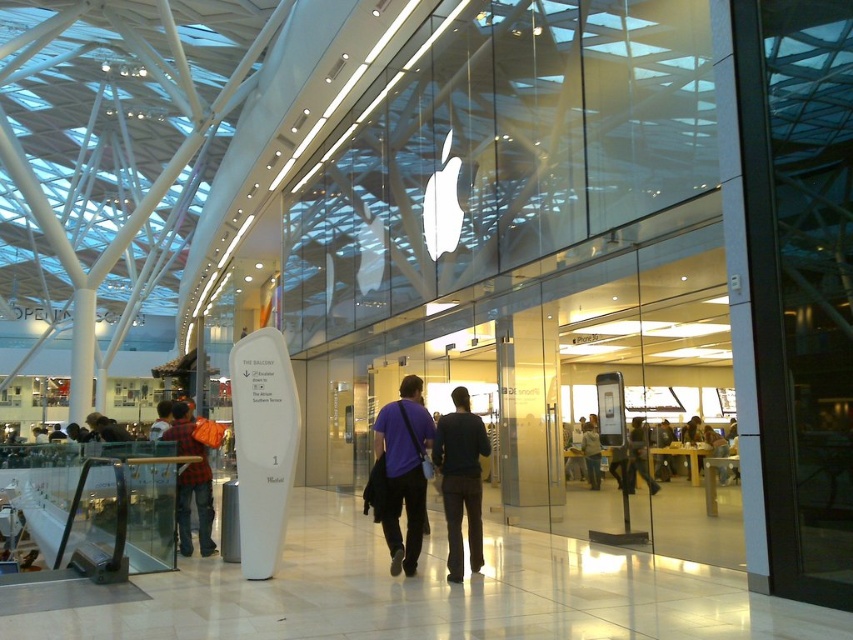
Question: Estimate the real-world distances between objects in this image. Which object is farther from the plaid shirt at left?

Choices:
 (A) black matte pants at center
 (B) matte black phone at center

Answer: (B)

Question: Is black matte pants at center thinner than light brown leather jacket at center?

Choices:
 (A) yes
 (B) no

Answer: (A)

Question: Which of these objects is positioned farthest from the purple fabric shirt at center?

Choices:
 (A) plaid shirt at left
 (B) black matte pants at center

Answer: (A)

Question: Based on their relative distances, which object is nearer to the plaid shirt at left?

Choices:
 (A) purple fabric shirt at center
 (B) light brown leather jacket at center

Answer: (A)

Question: Can you confirm if plaid shirt at left is bigger than matte black phone at center?

Choices:
 (A) no
 (B) yes

Answer: (A)

Question: Can you confirm if purple fabric shirt at center is thinner than light brown leather jacket at center?

Choices:
 (A) no
 (B) yes

Answer: (B)